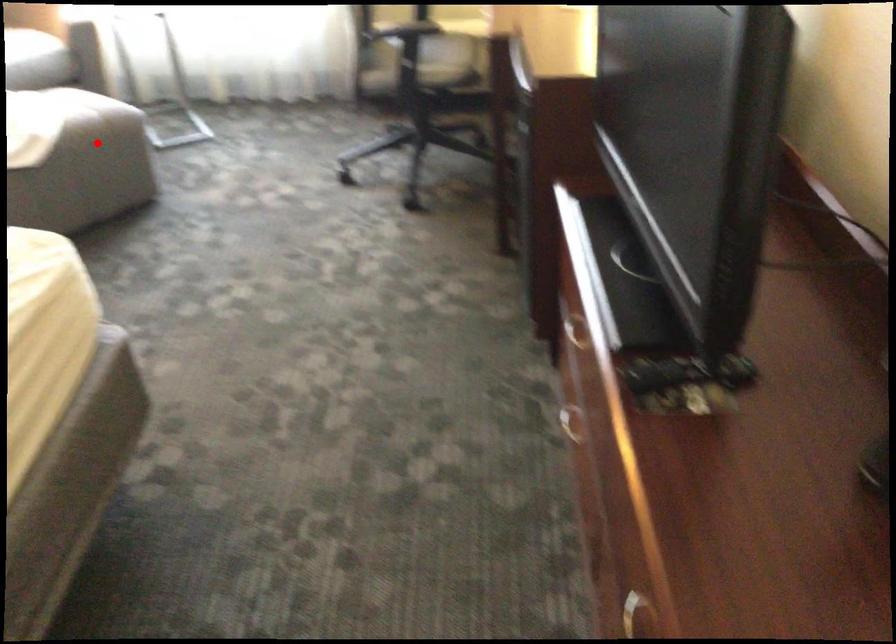
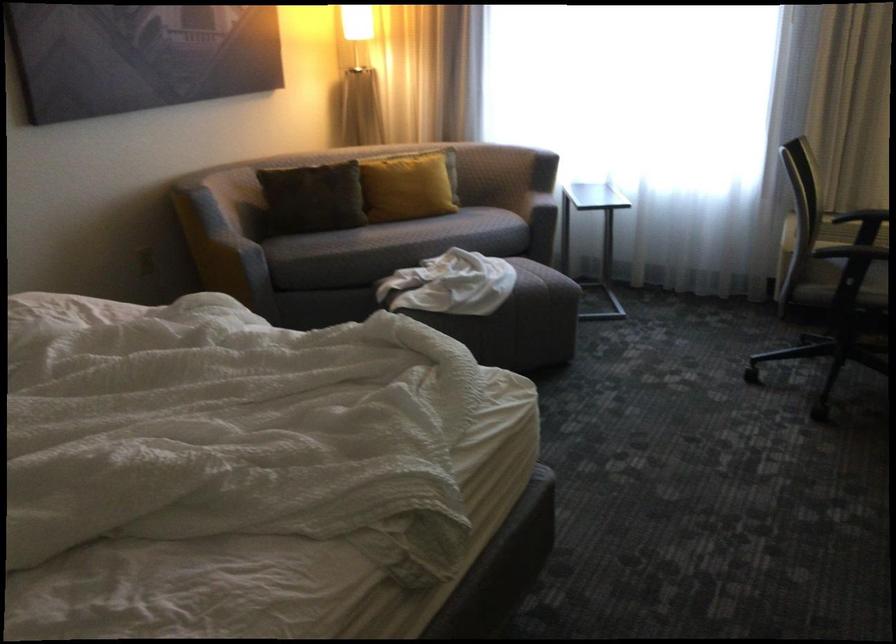
Where in the second image is the point corresponding to the highlighted location from the first image?

(538, 301)